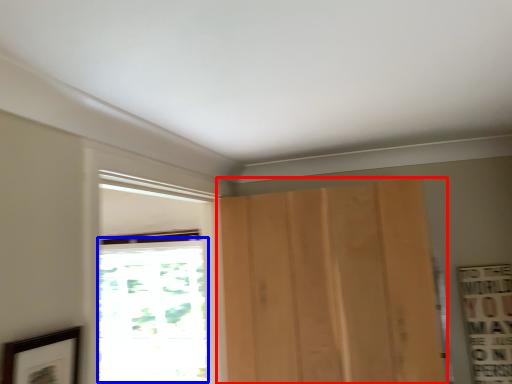
Question: Among these objects, which one is nearest to the camera, door (highlighted by a red box) or window (highlighted by a blue box)?

Choices:
 (A) door
 (B) window

Answer: (A)